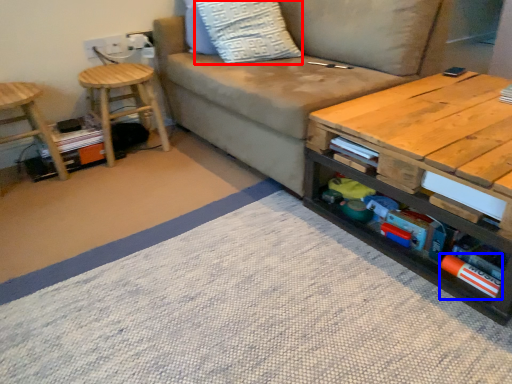
Question: Which point is closer to the camera, throw pillow (highlighted by a red box) or book (highlighted by a blue box)?

Choices:
 (A) throw pillow
 (B) book

Answer: (B)